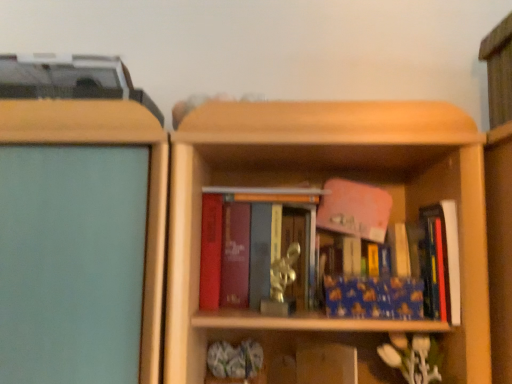
Question: Should I look upward or downward to see blue matte book at center, which appears as the second book when viewed from the right?

Choices:
 (A) down
 (B) up

Answer: (A)

Question: Does blue matte book at right, marked as the 1th book in a right-to-left arrangement, have a lesser width compared to matte red book at center, which is the first book in left-to-right order?

Choices:
 (A) no
 (B) yes

Answer: (A)

Question: Can you confirm if blue matte book at right, the third book in the left-to-right sequence, is taller than matte red book at center, which is the first book in left-to-right order?

Choices:
 (A) yes
 (B) no

Answer: (B)

Question: Is blue matte book at right, the third book in the left-to-right sequence, to the right of matte red book at center, which is counted as the 3th book, starting from the right, from the viewer's perspective?

Choices:
 (A) no
 (B) yes

Answer: (B)

Question: Is blue matte book at right, the third book in the left-to-right sequence, shorter than matte red book at center, which is counted as the 3th book, starting from the right?

Choices:
 (A) no
 (B) yes

Answer: (B)

Question: Considering the relative sizes of blue matte book at right, marked as the 1th book in a right-to-left arrangement, and matte red book at center, which is the first book in left-to-right order, in the image provided, is blue matte book at right, marked as the 1th book in a right-to-left arrangement, bigger than matte red book at center, which is the first book in left-to-right order,?

Choices:
 (A) no
 (B) yes

Answer: (A)

Question: Is blue matte book at right, marked as the 1th book in a right-to-left arrangement, smaller than matte red book at center, which is the first book in left-to-right order?

Choices:
 (A) no
 (B) yes

Answer: (B)

Question: Is blue matte book at right, the third book in the left-to-right sequence, a part of blue matte book at center, which appears as the second book when viewed from the right?

Choices:
 (A) no
 (B) yes

Answer: (A)

Question: From the image's perspective, is blue matte book at center, which appears as the second book when viewed from the right, under blue matte book at right, the third book in the left-to-right sequence?

Choices:
 (A) yes
 (B) no

Answer: (A)

Question: Does blue matte book at center, which appears as the second book when viewed from the right, have a larger size compared to blue matte book at right, the third book in the left-to-right sequence?

Choices:
 (A) no
 (B) yes

Answer: (A)

Question: From a real-world perspective, is blue matte book at center, which appears as the second book when viewed from the right, beneath blue matte book at right, marked as the 1th book in a right-to-left arrangement?

Choices:
 (A) yes
 (B) no

Answer: (A)

Question: Is the depth of blue matte book at center, which appears as the second book when viewed from the right, less than that of blue matte book at right, the third book in the left-to-right sequence?

Choices:
 (A) yes
 (B) no

Answer: (B)

Question: Does blue matte book at center, the 2th book positioned from the left, have a smaller size compared to blue matte book at right, marked as the 1th book in a right-to-left arrangement?

Choices:
 (A) yes
 (B) no

Answer: (A)

Question: From the image's perspective, is blue matte book at center, the 2th book positioned from the left, on top of matte red book at center, which is counted as the 3th book, starting from the right?

Choices:
 (A) no
 (B) yes

Answer: (A)